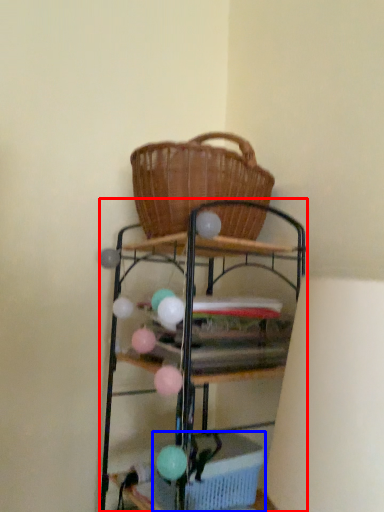
Question: Which object is further to the camera taking this photo, shelf (highlighted by a red box) or basket (highlighted by a blue box)?

Choices:
 (A) shelf
 (B) basket

Answer: (B)